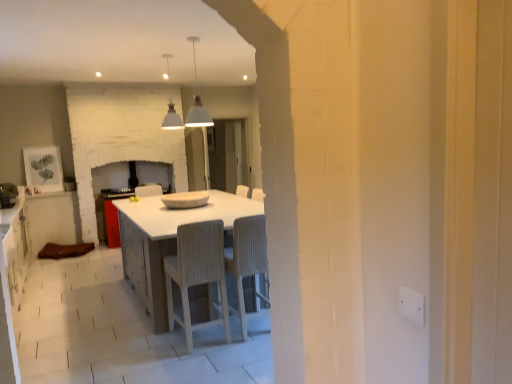
Question: From the image's perspective, does white plastic electric outlet at right appear higher than matte brown cabinet at left?

Choices:
 (A) no
 (B) yes

Answer: (B)

Question: Considering the relative sizes of white plastic electric outlet at right and matte brown cabinet at left in the image provided, is white plastic electric outlet at right smaller than matte brown cabinet at left?

Choices:
 (A) yes
 (B) no

Answer: (A)

Question: Is white plastic electric outlet at right looking in the opposite direction of matte brown cabinet at left?

Choices:
 (A) yes
 (B) no

Answer: (B)

Question: Does white plastic electric outlet at right have a greater width compared to matte brown cabinet at left?

Choices:
 (A) no
 (B) yes

Answer: (A)

Question: Is white plastic electric outlet at right closer to camera compared to matte brown cabinet at left?

Choices:
 (A) yes
 (B) no

Answer: (A)

Question: Does white plastic electric outlet at right have a larger size compared to matte brown cabinet at left?

Choices:
 (A) no
 (B) yes

Answer: (A)

Question: From a real-world perspective, does white textured chair at center, the second chair from the left, sit lower than white plastic electric outlet at right?

Choices:
 (A) no
 (B) yes

Answer: (B)

Question: Can you confirm if white textured chair at center, the second chair from the left, is positioned to the left of white plastic electric outlet at right?

Choices:
 (A) no
 (B) yes

Answer: (B)

Question: Does white textured chair at center, the second chair from the left, have a greater width compared to white plastic electric outlet at right?

Choices:
 (A) no
 (B) yes

Answer: (B)

Question: Is white textured chair at center, the second chair from the left, thinner than white plastic electric outlet at right?

Choices:
 (A) no
 (B) yes

Answer: (A)

Question: Can you confirm if white textured chair at center, marked as the first chair in a right-to-left arrangement, is taller than white plastic electric outlet at right?

Choices:
 (A) no
 (B) yes

Answer: (B)

Question: Is white textured chair at center, the second chair from the left, not near white plastic electric outlet at right?

Choices:
 (A) yes
 (B) no

Answer: (A)

Question: From the image's perspective, is brushed metal oven at left located above white textured chair at center, the second chair from the left?

Choices:
 (A) no
 (B) yes

Answer: (B)